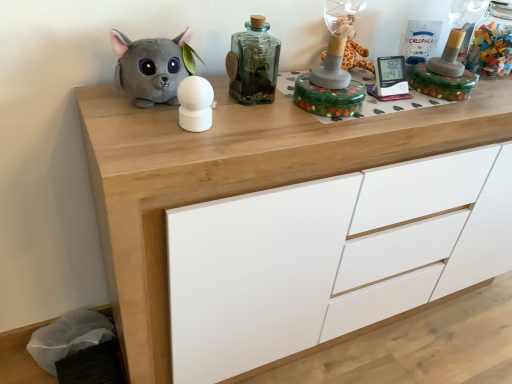
Image resolution: width=512 pixels, height=384 pixels. Identify the location of vacant region to the left of white matte sphere at center, which is the 2th toy from right to left. (135, 119).